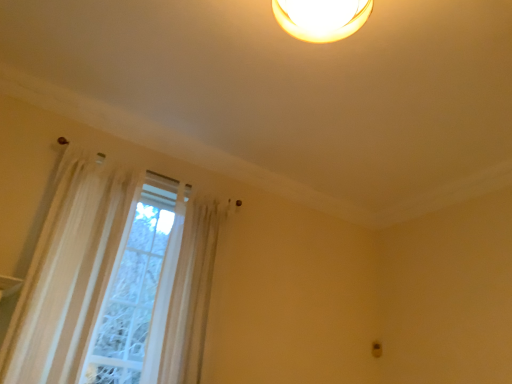
Find the location of a particular element. sheer white curtain at left is located at coordinates (69, 271).

This screenshot has width=512, height=384. What do you see at coordinates (69, 271) in the screenshot? I see `sheer white curtain at left` at bounding box center [69, 271].

The width and height of the screenshot is (512, 384). What do you see at coordinates (191, 293) in the screenshot?
I see `translucent white curtain at left` at bounding box center [191, 293].

This screenshot has width=512, height=384. Find the location of `translucent white curtain at left`. translucent white curtain at left is located at coordinates (191, 293).

What is the approximate height of translucent white curtain at left?

translucent white curtain at left is 4.47 feet in height.

The width and height of the screenshot is (512, 384). In order to click on sheer white curtain at left in this screenshot , I will do `click(69, 271)`.

Is sheer white curtain at left to the left of translucent white curtain at left from the viewer's perspective?

Yes, sheer white curtain at left is to the left of translucent white curtain at left.

In the image, is sheer white curtain at left positioned in front of or behind translucent white curtain at left?

Visually, sheer white curtain at left is located in front of translucent white curtain at left.

Considering the positions of point (29, 306) and point (178, 300), is point (29, 306) closer or farther from the camera than point (178, 300)?

Point (29, 306) appears to be closer to the viewer than point (178, 300).

From the image's perspective, which one is positioned higher, sheer white curtain at left or translucent white curtain at left?

sheer white curtain at left is shown above in the image.

From a real-world perspective, which object rests below the other?

sheer white curtain at left.

Between sheer white curtain at left and translucent white curtain at left, which one has larger width?

With larger width is translucent white curtain at left.

Considering the relative sizes of sheer white curtain at left and translucent white curtain at left in the image provided, is sheer white curtain at left shorter than translucent white curtain at left?

No.

Between sheer white curtain at left and translucent white curtain at left, which one has larger size?

With larger size is translucent white curtain at left.

Is sheer white curtain at left completely or partially outside of translucent white curtain at left?

That's correct, sheer white curtain at left is outside of translucent white curtain at left.

Consider the image. Is sheer white curtain at left next to translucent white curtain at left and touching it?

No, sheer white curtain at left is not beside translucent white curtain at left.

Is sheer white curtain at left aimed at translucent white curtain at left?

No, sheer white curtain at left is not oriented towards translucent white curtain at left.

Can you tell me how much sheer white curtain at left and translucent white curtain at left differ in facing direction?

They differ by 0.112 degrees in their facing directions.

Where is `shower curtain positioned vertically above the sheer white curtain at left (from a real-world perspective)`? This screenshot has width=512, height=384. shower curtain positioned vertically above the sheer white curtain at left (from a real-world perspective) is located at coordinates (191, 293).

Which object is positioned more to the right, translucent white curtain at left or sheer white curtain at left?

translucent white curtain at left is more to the right.

Does translucent white curtain at left come behind sheer white curtain at left?

Yes, it is behind sheer white curtain at left.

Which is nearer, [215,221] or [47,227]?

Positioned in front is point [47,227].

From the image's perspective, is translucent white curtain at left beneath sheer white curtain at left?

Indeed, from the image's perspective, translucent white curtain at left is shown beneath sheer white curtain at left.

From a real-world perspective, is translucent white curtain at left below sheer white curtain at left?

No, from a real-world perspective, translucent white curtain at left is not under sheer white curtain at left.

Does translucent white curtain at left have a greater width compared to sheer white curtain at left?

Yes, translucent white curtain at left is wider than sheer white curtain at left.

Between translucent white curtain at left and sheer white curtain at left, which one has more height?

With more height is sheer white curtain at left.

Is translucent white curtain at left bigger than sheer white curtain at left?

Yes.

Can sheer white curtain at left be found inside translucent white curtain at left?

That's incorrect, sheer white curtain at left is not inside translucent white curtain at left.

Is there a large distance between translucent white curtain at left and sheer white curtain at left?

They are positioned close to each other.

Is sheer white curtain at left at the back of translucent white curtain at left?

translucent white curtain at left does not have its back to sheer white curtain at left.

Can you tell me how much translucent white curtain at left and sheer white curtain at left differ in facing direction?

The facing directions of translucent white curtain at left and sheer white curtain at left are 0.112 degrees apart.

In the image, there is a sheer white curtain at left. At what (x,y) coordinates should I click in order to perform the action: click on shower curtain below it (from the image's perspective). Please return your answer as a coordinate pair (x, y). Looking at the image, I should click on (191, 293).

Identify the location of curtain lying on the left of translucent white curtain at left. Image resolution: width=512 pixels, height=384 pixels. (69, 271).

Locate an element on the screen. The width and height of the screenshot is (512, 384). curtain below the translucent white curtain at left (from a real-world perspective) is located at coordinates (69, 271).